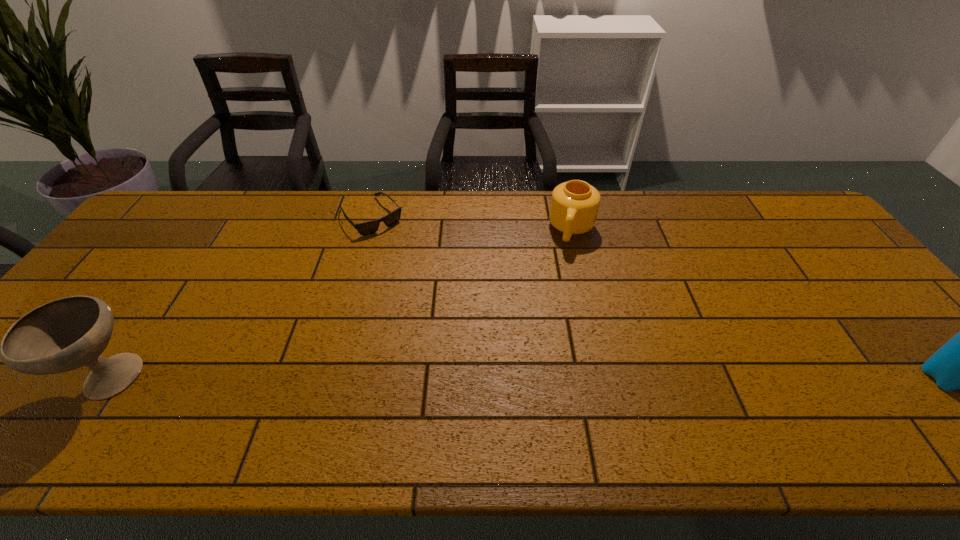
The width and height of the screenshot is (960, 540). Find the location of `free location located on the handle side of the third object from left to right`. free location located on the handle side of the third object from left to right is located at coordinates (552, 312).

At what (x,y) coordinates should I click in order to perform the action: click on free spot located on the handle side of the third object from left to right. Please return your answer as a coordinate pair (x, y). The image size is (960, 540). Looking at the image, I should click on (557, 293).

At what (x,y) coordinates should I click in order to perform the action: click on vacant region located 0.250m on the handle side of the third object from left to right. Please return your answer as a coordinate pair (x, y). The height and width of the screenshot is (540, 960). Looking at the image, I should click on (553, 309).

Identify the location of sunglasses that is at the far edge. The image size is (960, 540). (366, 228).

Where is `mug situated at the far edge`? This screenshot has height=540, width=960. mug situated at the far edge is located at coordinates (574, 207).

I want to click on object positioned at the near edge, so click(65, 334).

In order to click on object at the left edge in this screenshot , I will do `click(65, 334)`.

Locate an element on the screen. object that is positioned at the near left corner is located at coordinates (65, 334).

The width and height of the screenshot is (960, 540). In the image, there is a desktop. Identify the location of vacant space at the far edge. (550, 225).

The image size is (960, 540). I want to click on free space at the near edge of the desktop, so click(813, 397).